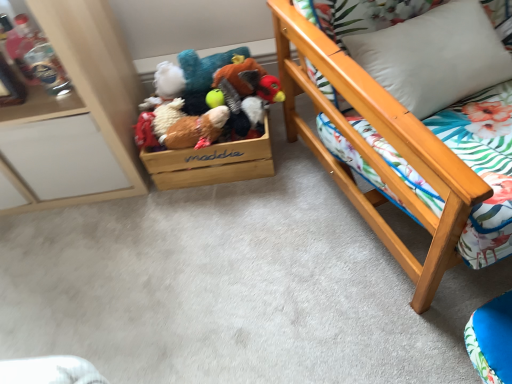
Question: Is white soft pillow at upper right inside or outside of wooden bed frame at right, which appears as the 1th furniture when viewed from the right?

Choices:
 (A) inside
 (B) outside

Answer: (A)

Question: Relative to wooden bed frame at right, arranged as the 2th furniture when viewed from the left, is white soft pillow at upper right in front or behind?

Choices:
 (A) behind
 (B) front

Answer: (A)

Question: Which of these objects is positioned closest to the fluffy brown plush at center, marked as the second toy in a back-to-front arrangement?

Choices:
 (A) white soft pillow at upper right
 (B) wooden plush toys at center, which is counted as the 2th toy, starting from the front
 (C) wooden bed frame at right, which appears as the 1th furniture when viewed from the right
 (D) wooden cabinet at left, the 1th furniture from the left

Answer: (B)

Question: Which object is positioned farthest from the wooden bed frame at right, which appears as the 1th furniture when viewed from the right?

Choices:
 (A) wooden cabinet at left, positioned as the second furniture in right-to-left order
 (B) fluffy brown plush at center, acting as the first toy starting from the front
 (C) wooden plush toys at center, the first toy in the back-to-front sequence
 (D) white soft pillow at upper right

Answer: (A)